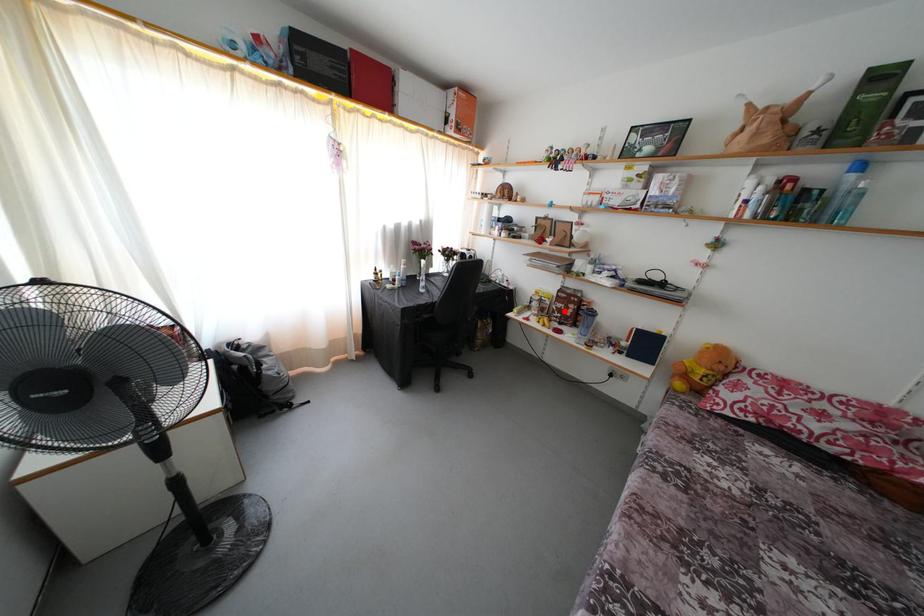
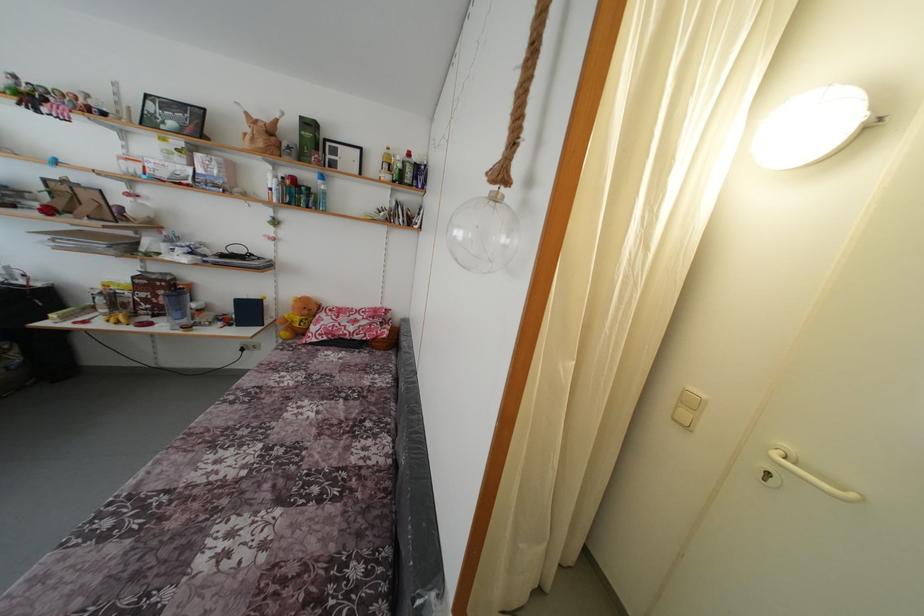
Question: I am providing you with two images of the same scene from different viewpoints. A red point is marked on the first image. Can you still see the location of the red point in image 2?

Choices:
 (A) Yes
 (B) No

Answer: (A)